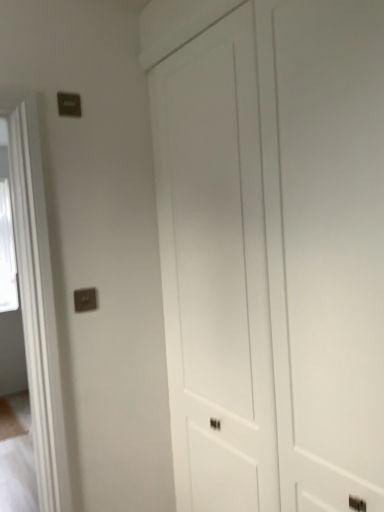
Question: Should I look upward or downward to see matte silver switch at upper left?

Choices:
 (A) up
 (B) down

Answer: (B)

Question: Is matte silver switch at upper left to the left of white matte door at center from the viewer's perspective?

Choices:
 (A) no
 (B) yes

Answer: (B)

Question: Is matte silver switch at upper left smaller than white matte door at center?

Choices:
 (A) no
 (B) yes

Answer: (B)

Question: Is matte silver switch at upper left oriented away from white matte door at center?

Choices:
 (A) yes
 (B) no

Answer: (B)

Question: Does matte silver switch at upper left have a greater width compared to white matte door at center?

Choices:
 (A) no
 (B) yes

Answer: (A)

Question: Can you confirm if matte silver switch at upper left is shorter than white matte door at center?

Choices:
 (A) yes
 (B) no

Answer: (A)

Question: Is matte silver switch at upper left positioned in front of white matte door at center?

Choices:
 (A) yes
 (B) no

Answer: (B)

Question: Can you confirm if white matte door at center is positioned to the left of matte silver switch at upper left?

Choices:
 (A) yes
 (B) no

Answer: (B)

Question: Is white matte door at center to the right of matte silver switch at upper left from the viewer's perspective?

Choices:
 (A) yes
 (B) no

Answer: (A)

Question: Is matte silver switch at upper left at the back of white matte door at center?

Choices:
 (A) yes
 (B) no

Answer: (B)

Question: Could you tell me if white matte door at center is facing matte silver switch at upper left?

Choices:
 (A) no
 (B) yes

Answer: (B)

Question: Does white matte door at center have a lesser height compared to matte silver switch at upper left?

Choices:
 (A) no
 (B) yes

Answer: (A)

Question: Considering the relative sizes of white matte door at center and matte silver switch at upper left in the image provided, is white matte door at center taller than matte silver switch at upper left?

Choices:
 (A) yes
 (B) no

Answer: (A)

Question: Is point (274, 13) closer or farther from the camera than point (86, 303)?

Choices:
 (A) farther
 (B) closer

Answer: (B)